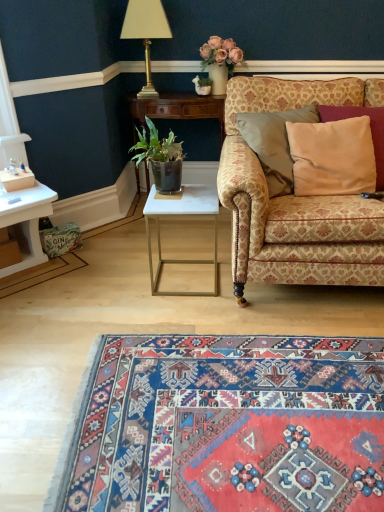
Question: Does patterned fabric couch at right turn towards green leafy plant in dark pot at center?

Choices:
 (A) no
 (B) yes

Answer: (A)

Question: Can you confirm if patterned fabric couch at right is smaller than green leafy plant in dark pot at center?

Choices:
 (A) yes
 (B) no

Answer: (B)

Question: Does patterned fabric couch at right have a lesser height compared to green leafy plant in dark pot at center?

Choices:
 (A) no
 (B) yes

Answer: (A)

Question: From the image's perspective, is patterned fabric couch at right located above green leafy plant in dark pot at center?

Choices:
 (A) no
 (B) yes

Answer: (A)

Question: Considering the relative sizes of patterned fabric couch at right and green leafy plant in dark pot at center in the image provided, is patterned fabric couch at right wider than green leafy plant in dark pot at center?

Choices:
 (A) no
 (B) yes

Answer: (B)

Question: Does point (357, 462) appear closer or farther from the camera than point (349, 143)?

Choices:
 (A) closer
 (B) farther

Answer: (A)

Question: From the image's perspective, is carpet with intricate patterns at lower center positioned above or below beige satin pillow at right?

Choices:
 (A) below
 (B) above

Answer: (A)

Question: Looking at the image, does carpet with intricate patterns at lower center seem bigger or smaller compared to beige satin pillow at right?

Choices:
 (A) big
 (B) small

Answer: (A)

Question: Is carpet with intricate patterns at lower center inside the boundaries of beige satin pillow at right, or outside?

Choices:
 (A) outside
 (B) inside

Answer: (A)

Question: Is beige satin pillow at right spatially inside carpet with intricate patterns at lower center, or outside of it?

Choices:
 (A) inside
 (B) outside

Answer: (B)

Question: Would you say beige satin pillow at right is to the left or to the right of carpet with intricate patterns at lower center in the picture?

Choices:
 (A) left
 (B) right

Answer: (B)

Question: From the image's perspective, is beige satin pillow at right located above or below carpet with intricate patterns at lower center?

Choices:
 (A) below
 (B) above

Answer: (B)

Question: From a real-world perspective, is beige satin pillow at right above or below carpet with intricate patterns at lower center?

Choices:
 (A) above
 (B) below

Answer: (A)

Question: Is patterned fabric couch at right taller or shorter than gold metallic lamp at upper center?

Choices:
 (A) short
 (B) tall

Answer: (B)

Question: Considering the positions of point (296, 97) and point (160, 16), is point (296, 97) closer or farther from the camera than point (160, 16)?

Choices:
 (A) closer
 (B) farther

Answer: (A)